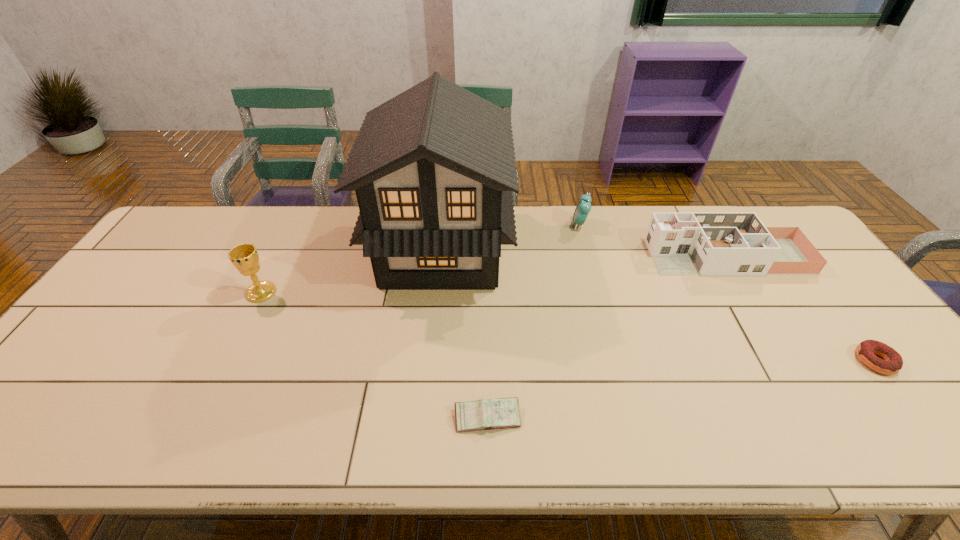
Find the location of `the left dollhouse`. the left dollhouse is located at coordinates (433, 168).

At what (x,y) coordinates should I click in order to perform the action: click on the tallest object. Please return your answer as a coordinate pair (x, y). Looking at the image, I should click on (433, 168).

I want to click on the second tallest object, so click(x=244, y=257).

Where is `the leftmost object`? the leftmost object is located at coordinates (244, 257).

In order to click on the fourth object from left to right in this screenshot , I will do tap(583, 207).

Identify the location of the right dollhouse. (708, 244).

You are a GUI agent. You are given a task and a screenshot of the screen. Output one action in this format:
    pyautogui.click(x=<x>, y=<y>)
    Task: Click on the second shortest object
    This screenshot has height=540, width=960.
    Given the screenshot: What is the action you would take?
    pyautogui.click(x=500, y=413)

Where is `the nearest object`? the nearest object is located at coordinates (500, 413).

Find the location of a particular element. This screenshot has width=960, height=540. the second nearest object is located at coordinates (892, 364).

Where is `the shortest object`? The height and width of the screenshot is (540, 960). the shortest object is located at coordinates tap(892, 364).